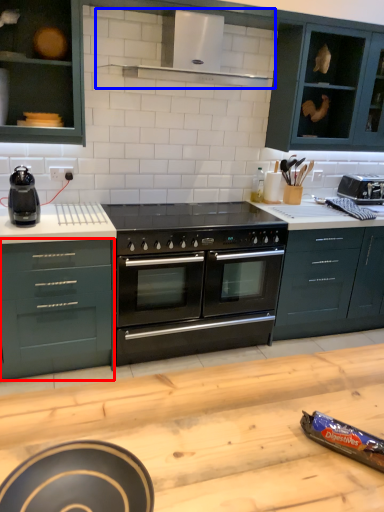
Question: Which object appears farthest to the camera in this image, drawer (highlighted by a red box) or exhaust hood (highlighted by a blue box)?

Choices:
 (A) drawer
 (B) exhaust hood

Answer: (A)